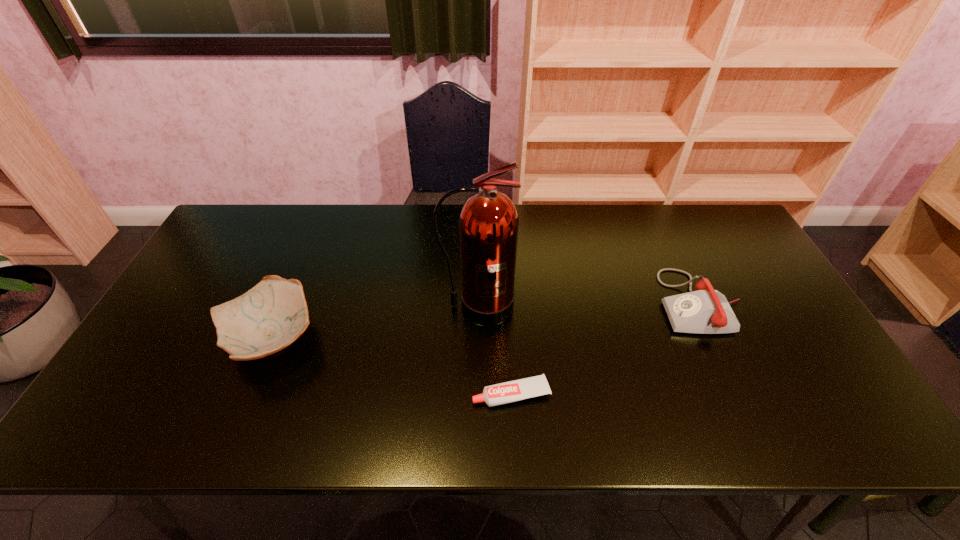
The image size is (960, 540). I want to click on blank region between the shortest object and the tallest object, so click(x=494, y=350).

Where is `empty location between the rightmost object and the shortest object`? empty location between the rightmost object and the shortest object is located at coordinates (606, 348).

Find the location of `blank region between the second tallest object and the tallest object`. blank region between the second tallest object and the tallest object is located at coordinates (374, 323).

You are a GUI agent. You are given a task and a screenshot of the screen. Output one action in this format:
    pyautogui.click(x=<x>, y=<y>)
    Task: Click on the free spot between the toothpaste and the rightmost object
    Image resolution: width=960 pixels, height=540 pixels.
    Given the screenshot: What is the action you would take?
    pyautogui.click(x=606, y=348)

I want to click on free space between the telephone and the shortest object, so click(x=606, y=348).

Locate an element on the screen. The image size is (960, 540). vacant area that lies between the third shortest object and the tallest object is located at coordinates (374, 323).

At what (x,y) coordinates should I click in order to perform the action: click on free space between the leftmost object and the shortest object. Please return your answer as a coordinate pair (x, y). Image resolution: width=960 pixels, height=540 pixels. Looking at the image, I should click on (392, 366).

You are a GUI agent. You are given a task and a screenshot of the screen. Output one action in this format:
    pyautogui.click(x=<x>, y=<y>)
    Task: Click on the third closest object to the pottery
    
    Given the screenshot: What is the action you would take?
    pyautogui.click(x=705, y=311)

Choose which object is the third nearest neighbor to the tallest object. Please provide its 2D coordinates. Your answer should be formatted as a tuple, i.e. [(x, y)], where the tuple contains the x and y coordinates of a point satisfying the conditions above.

[(705, 311)]

Where is `free space that satisfies the following two spatial constraints: 1. on the front-facing side of the tallest object; 2. on the right side of the toothpaste`? The height and width of the screenshot is (540, 960). free space that satisfies the following two spatial constraints: 1. on the front-facing side of the tallest object; 2. on the right side of the toothpaste is located at coordinates (477, 394).